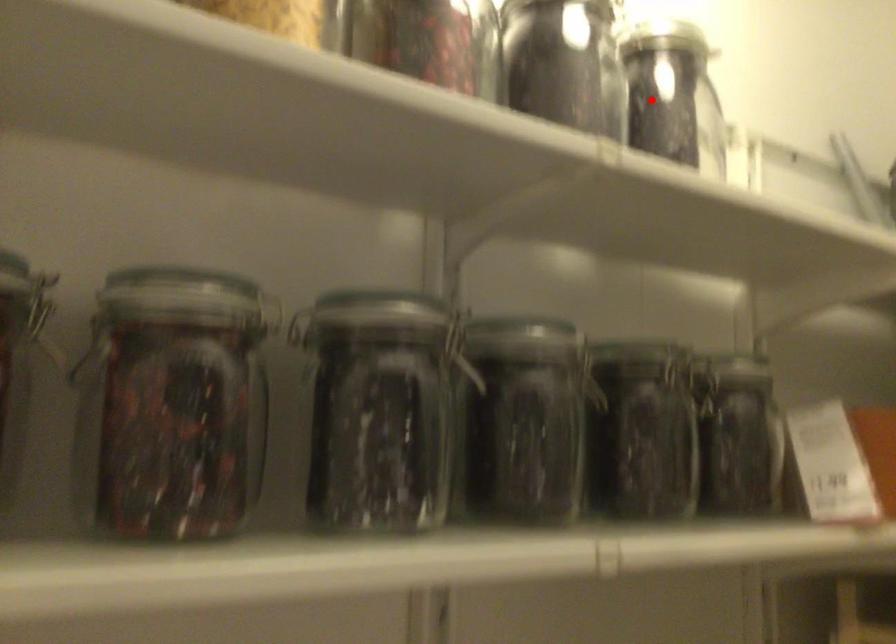
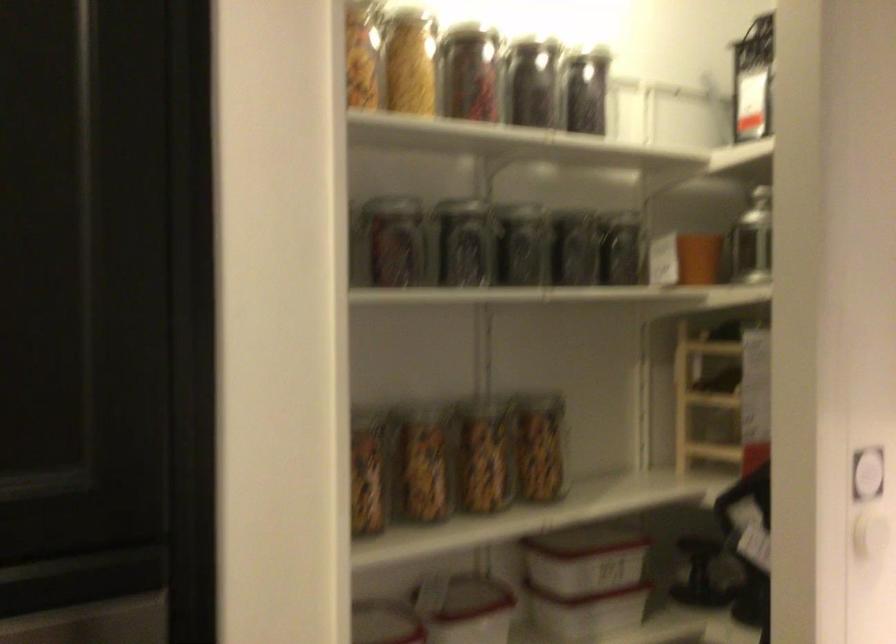
Question: I am providing you with two images of the same scene from different viewpoints. Image1 has a red point marked. In image2, the corresponding 3D location appears at what relative position? Reply with the corresponding letter.

Choices:
 (A) Closer
 (B) Farther

Answer: (B)